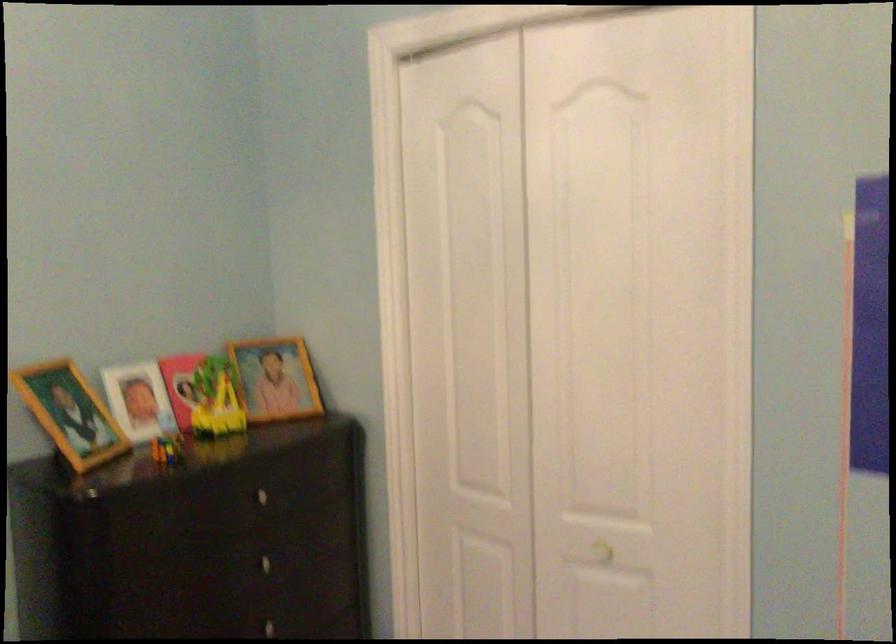
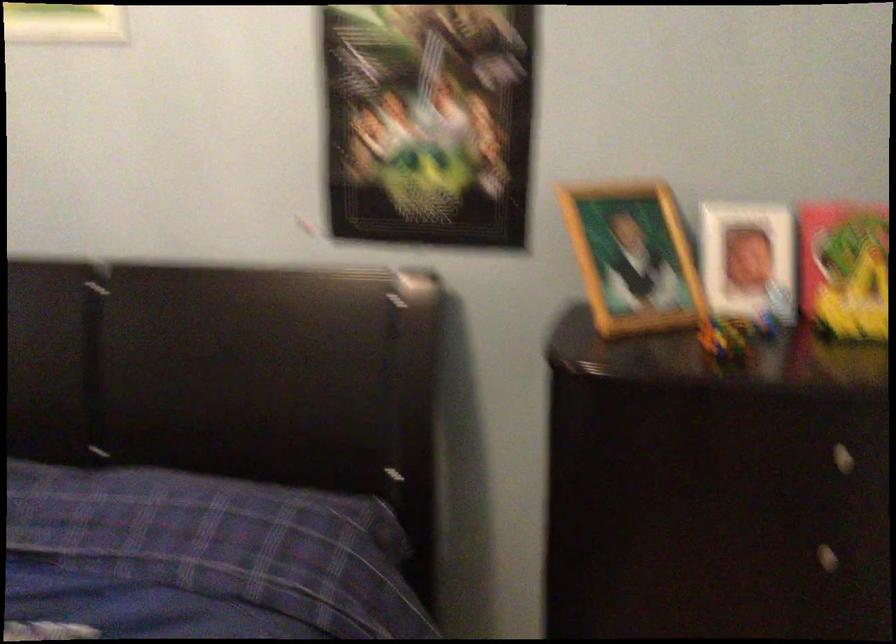
Locate, in the second image, the point that corresponds to the point at 72,413 in the first image.

(633, 258)